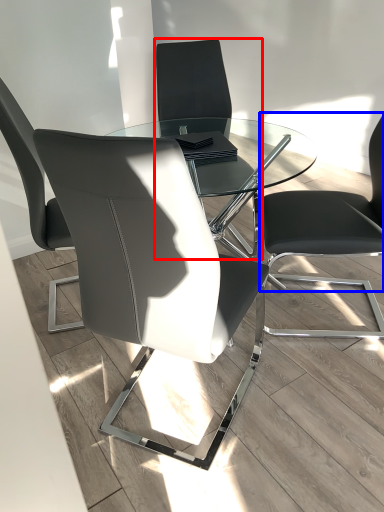
Question: Which object is further to the camera taking this photo, chair (highlighted by a red box) or chair (highlighted by a blue box)?

Choices:
 (A) chair
 (B) chair

Answer: (A)